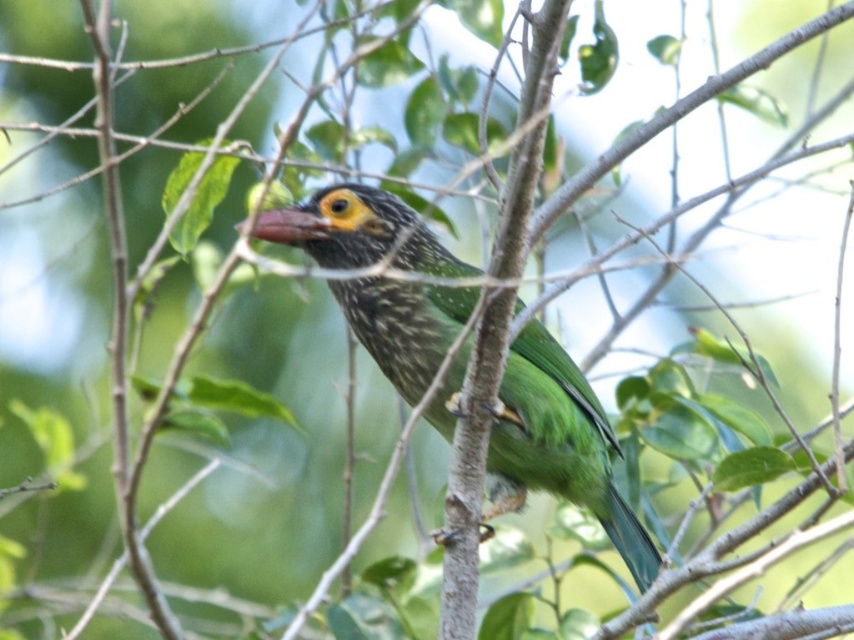
You are a birdwatcher holding a measuring tape. You see the green glossy bird at center and the smooth red beak at center. How far apart are they?

The distance between the green glossy bird at center and the smooth red beak at center is 14.09 inches.

You are an ornithologist observing the green glossy bird at center and the smooth red beak at center. Which object has a greater width?

The green glossy bird at center has a greater width than the smooth red beak at center.